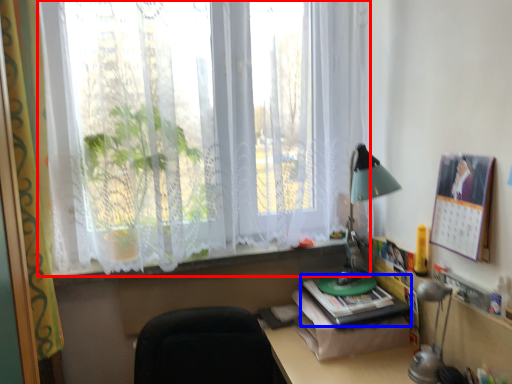
Question: Which object is further to the camera taking this photo, window (highlighted by a red box) or paperback book (highlighted by a blue box)?

Choices:
 (A) window
 (B) paperback book

Answer: (B)